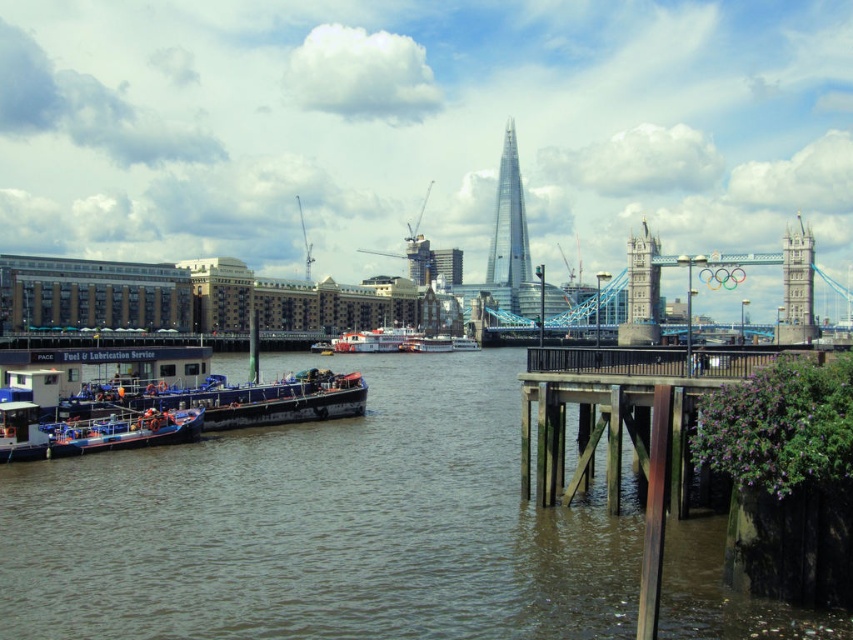
Question: Is brown water at lower left below stone gray suspension bridge at center?

Choices:
 (A) yes
 (B) no

Answer: (A)

Question: Estimate the real-world distances between objects in this image. Which object is farther from the brown wooden dock at lower right?

Choices:
 (A) white plastic boat at center
 (B) brown water at lower left
 (C) glassy steel skyscraper at center
 (D) stone tower at center

Answer: (C)

Question: Which point is closer to the camera?

Choices:
 (A) brown water at lower left
 (B) stone gray suspension bridge at center
 (C) blue wooden boat at center
 (D) brown wooden dock at lower right

Answer: (D)

Question: Is stone tower at right positioned before stone tower at center?

Choices:
 (A) no
 (B) yes

Answer: (B)

Question: Can you confirm if brown water at lower left is positioned to the right of white plastic boat at center?

Choices:
 (A) no
 (B) yes

Answer: (B)

Question: Which point is farther from the camera taking this photo?

Choices:
 (A) (509, 124)
 (B) (347, 344)
 (C) (809, 230)

Answer: (A)